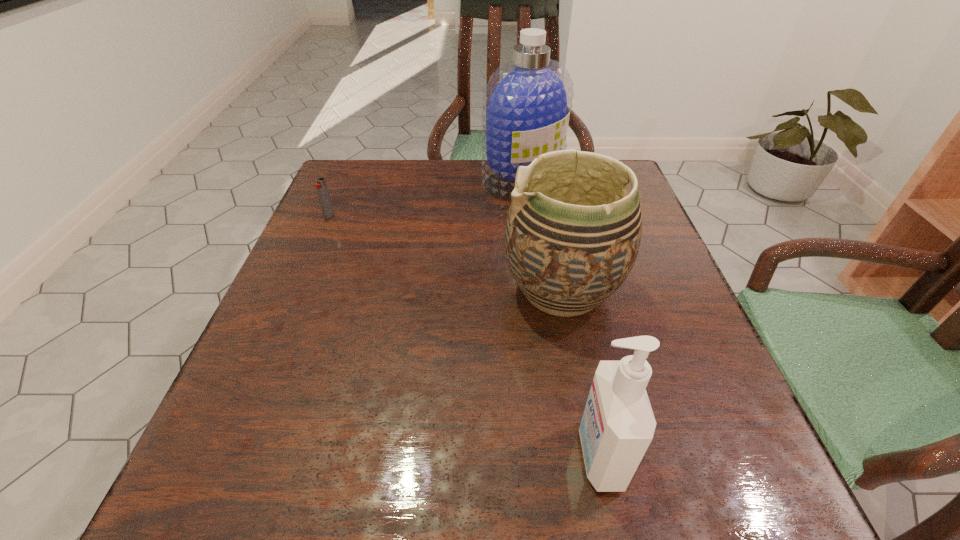
Locate which object is the closest to the nearer cleansing agent. Please provide its 2D coordinates. Your answer should be formatted as a tuple, i.e. [(x, y)], where the tuple contains the x and y coordinates of a point satisfying the conditions above.

[(572, 236)]

The image size is (960, 540). What are the coordinates of `object that is the third closest one to the nearer cleansing agent` in the screenshot? It's located at (321, 187).

Identify the location of free space that satisfies the following two spatial constraints: 1. on the front side of the third nearest object; 2. on the right side of the pottery. Image resolution: width=960 pixels, height=540 pixels. (297, 290).

Image resolution: width=960 pixels, height=540 pixels. I want to click on vacant region that satisfies the following two spatial constraints: 1. on the back side of the farthest object; 2. on the right side of the leftmost object, so click(x=345, y=180).

At what (x,y) coordinates should I click in order to perform the action: click on blank space that satisfies the following two spatial constraints: 1. on the front side of the farthest object; 2. on the left side of the pottery. Please return your answer as a coordinate pair (x, y). Looking at the image, I should click on (538, 290).